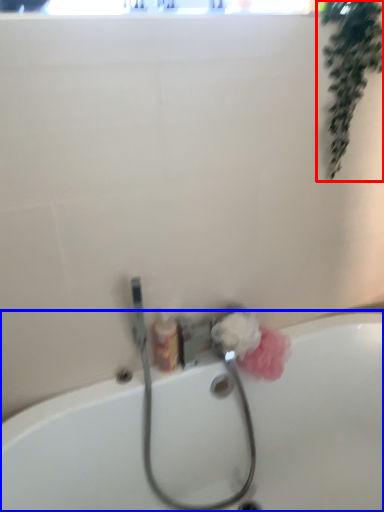
Question: Which of the following is the closest to the observer, plant (highlighted by a red box) or bathtub (highlighted by a blue box)?

Choices:
 (A) plant
 (B) bathtub

Answer: (B)